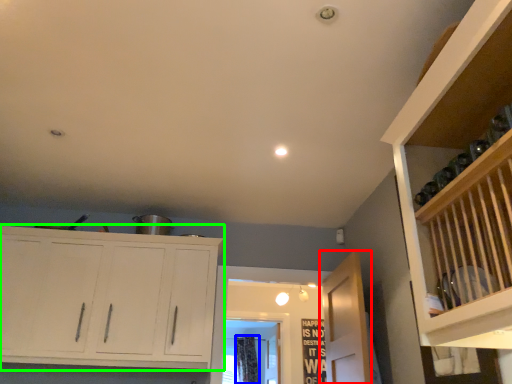
Question: Considering the real-world distances, which object is closest to door (highlighted by a red box)? curtain (highlighted by a blue box) or cupboard (highlighted by a green box).

Choices:
 (A) curtain
 (B) cupboard

Answer: (B)